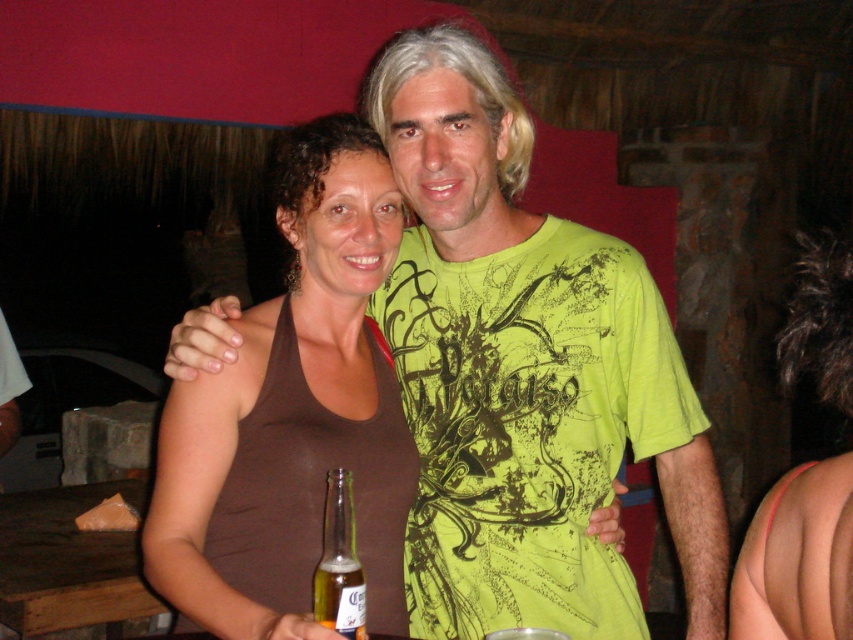
Question: Is brown fabric tank top at center positioned behind translucent glass bottle at lower center?

Choices:
 (A) yes
 (B) no

Answer: (B)

Question: Which point is closer to the camera taking this photo?

Choices:
 (A) (396, 465)
 (B) (339, 536)
 (C) (416, 257)
 (D) (340, 580)

Answer: (B)

Question: Estimate the real-world distances between objects in this image. Which object is farther from the gold glass bottle at lower center?

Choices:
 (A) green printed t-shirt at center
 (B) translucent glass bottle at lower center

Answer: (A)

Question: Is translucent glass bottle at lower center positioned behind gold glass bottle at lower center?

Choices:
 (A) no
 (B) yes

Answer: (A)

Question: Among these objects, which one is farthest from the camera?

Choices:
 (A) gold glass bottle at lower center
 (B) brown fabric tank top at center
 (C) green printed t-shirt at center
 (D) translucent glass bottle at lower center

Answer: (C)

Question: Can you confirm if green printed t-shirt at center is wider than gold glass bottle at lower center?

Choices:
 (A) yes
 (B) no

Answer: (A)